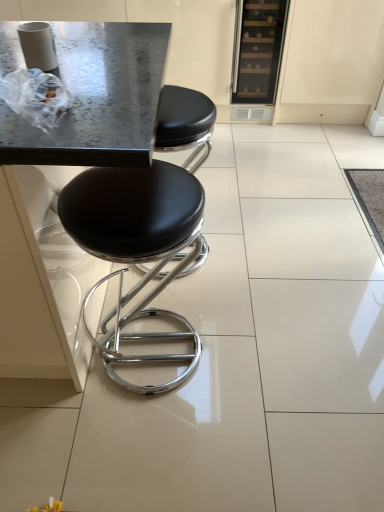
Question: Does metallic gray table at center come behind matte glass wine cooler at upper right?

Choices:
 (A) yes
 (B) no

Answer: (B)

Question: Is metallic gray table at center turned away from matte glass wine cooler at upper right?

Choices:
 (A) no
 (B) yes

Answer: (A)

Question: Does metallic gray table at center have a lesser width compared to matte glass wine cooler at upper right?

Choices:
 (A) yes
 (B) no

Answer: (B)

Question: Can you confirm if metallic gray table at center is wider than matte glass wine cooler at upper right?

Choices:
 (A) yes
 (B) no

Answer: (A)

Question: Is metallic gray table at center far away from matte glass wine cooler at upper right?

Choices:
 (A) yes
 (B) no

Answer: (A)

Question: Is metallic gray table at center bigger than matte glass wine cooler at upper right?

Choices:
 (A) yes
 (B) no

Answer: (A)

Question: Is matte glass wine cooler at upper right positioned with its back to metallic gray table at center?

Choices:
 (A) yes
 (B) no

Answer: (B)

Question: Is matte glass wine cooler at upper right wider than metallic gray table at center?

Choices:
 (A) no
 (B) yes

Answer: (A)

Question: Considering the relative positions of matte glass wine cooler at upper right and metallic gray table at center in the image provided, is matte glass wine cooler at upper right to the right of metallic gray table at center from the viewer's perspective?

Choices:
 (A) no
 (B) yes

Answer: (B)

Question: Is matte glass wine cooler at upper right thinner than metallic gray table at center?

Choices:
 (A) no
 (B) yes

Answer: (B)

Question: Does matte glass wine cooler at upper right have a lesser height compared to metallic gray table at center?

Choices:
 (A) no
 (B) yes

Answer: (B)

Question: Does matte glass wine cooler at upper right appear on the left side of metallic gray table at center?

Choices:
 (A) yes
 (B) no

Answer: (B)

Question: Could you tell me if metallic gray table at center is facing black leather stool at center?

Choices:
 (A) no
 (B) yes

Answer: (A)